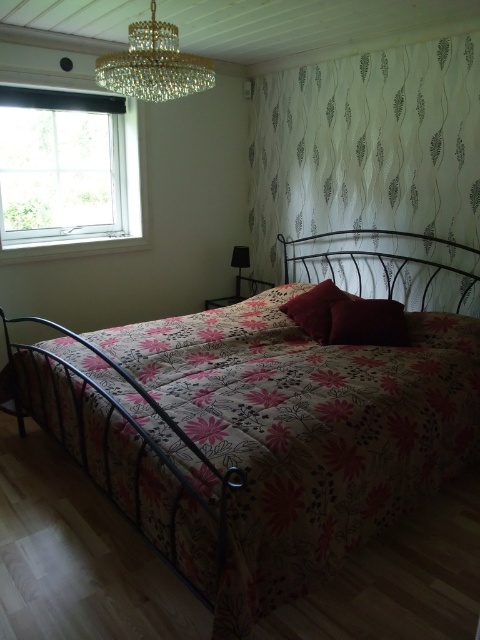
You are standing at the foot of the bed and want to reach both the white textured curtain at upper center and the brown velvet pillow at center. Which object will you need to move closer to first?

The white textured curtain at upper center is closer to the viewer than the brown velvet pillow at center, so you will need to move closer to the white textured curtain at upper center first.